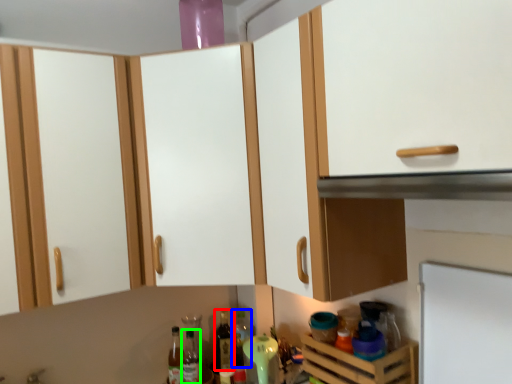
Question: Which object is the farthest from bottle (highlighted by a red box)? Choose among these: bottle (highlighted by a blue box) or bottle (highlighted by a green box).

Choices:
 (A) bottle
 (B) bottle

Answer: (B)